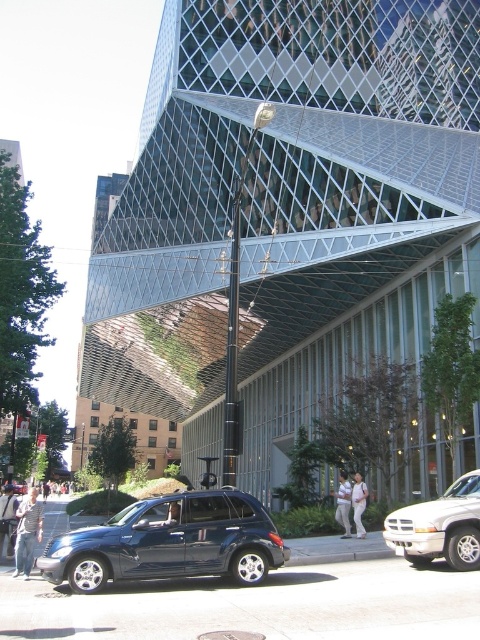
Is silver metallic truck at lower right below shiny dark blue sedan at center?

No.

Consider the image. Does silver metallic truck at lower right appear over shiny dark blue sedan at center?

Yes.

Is point (462, 531) positioned behind point (6, 481)?

No, it is in front of (6, 481).

Where is `silver metallic truck at lower right`? silver metallic truck at lower right is located at coordinates (440, 525).

Is matte dark blue suv at lower left taller than shiny dark blue sedan at center?

No.

Can you confirm if matte dark blue suv at lower left is positioned above shiny dark blue sedan at center?

Yes.

Identify the location of matte dark blue suv at lower left. (169, 541).

Is matte dark blue suv at lower left closer to the viewer compared to silver metallic truck at lower right?

Yes, it is.

You are a GUI agent. You are given a task and a screenshot of the screen. Output one action in this format:
    pyautogui.click(x=<x>, y=<y>)
    Task: Click on the matte dark blue suv at lower left
    This screenshot has height=640, width=480.
    Given the screenshot: What is the action you would take?
    pyautogui.click(x=169, y=541)

Find the location of `matte dark blue suv at lower left`. matte dark blue suv at lower left is located at coordinates (169, 541).